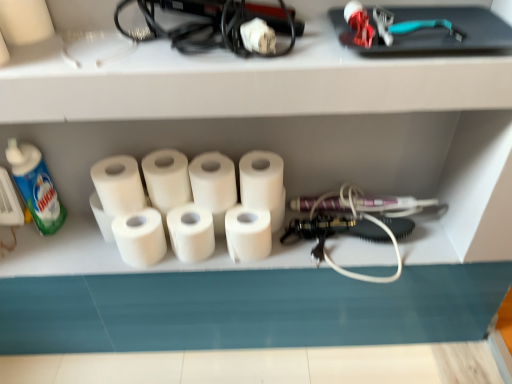
You are a GUI agent. You are given a task and a screenshot of the screen. Output one action in this format:
    pyautogui.click(x=<x>, y=<y>)
    Task: Click on the vacant region to the left of white matte toilet paper at center, the fifth toilet paper positioned from the right
    This screenshot has width=512, height=384.
    Given the screenshot: What is the action you would take?
    74,248